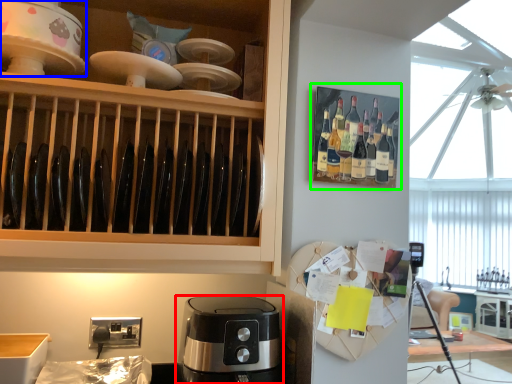
Question: Which is nearer to the coffee maker (highlighted by a red box)? home appliance (highlighted by a blue box) or shelf (highlighted by a green box).

Choices:
 (A) home appliance
 (B) shelf

Answer: (B)